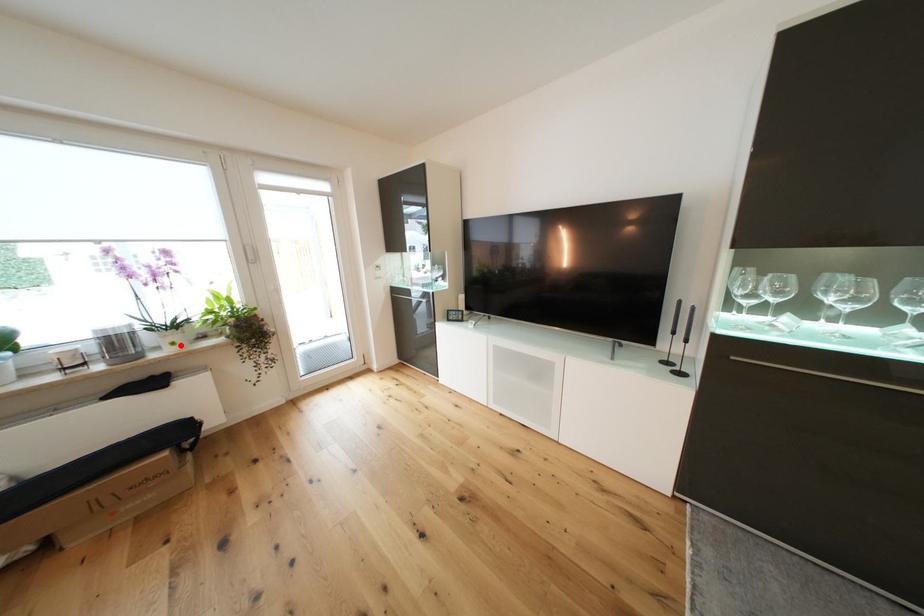
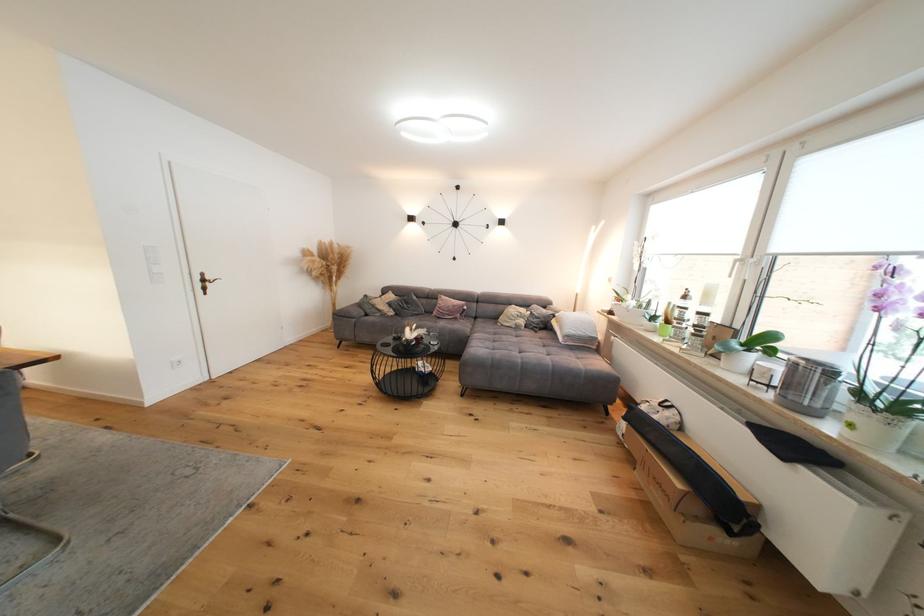
Locate, in the second image, the point that corresponds to the highlighted location in the first image.

(858, 427)